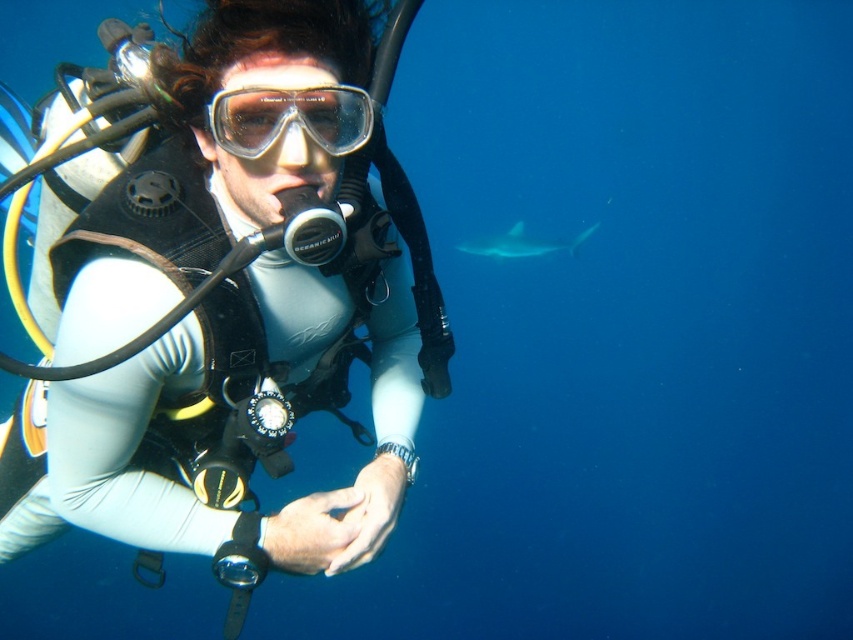
Question: Is white matte wetsuit at center positioned behind gray matte shark at upper right?

Choices:
 (A) no
 (B) yes

Answer: (A)

Question: Which is farther from the white matte wetsuit at center?

Choices:
 (A) gray matte shark at upper right
 (B) transparent plastic goggles at center

Answer: (A)

Question: Which of the following is the farthest from the observer?

Choices:
 (A) transparent plastic goggles at center
 (B) gray matte shark at upper right
 (C) white matte wetsuit at center

Answer: (B)

Question: Is transparent plastic goggles at center wider than gray matte shark at upper right?

Choices:
 (A) no
 (B) yes

Answer: (A)

Question: Which object is positioned farthest from the white matte wetsuit at center?

Choices:
 (A) gray matte shark at upper right
 (B) transparent plastic goggles at center

Answer: (A)

Question: Does transparent plastic goggles at center have a smaller size compared to gray matte shark at upper right?

Choices:
 (A) no
 (B) yes

Answer: (B)